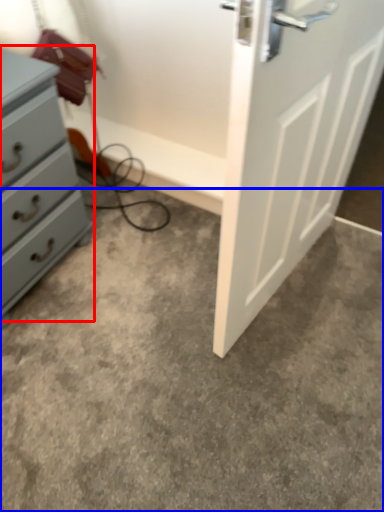
Question: Among these objects, which one is nearest to the camera, chest of drawers (highlighted by a red box) or concrete (highlighted by a blue box)?

Choices:
 (A) chest of drawers
 (B) concrete

Answer: (B)